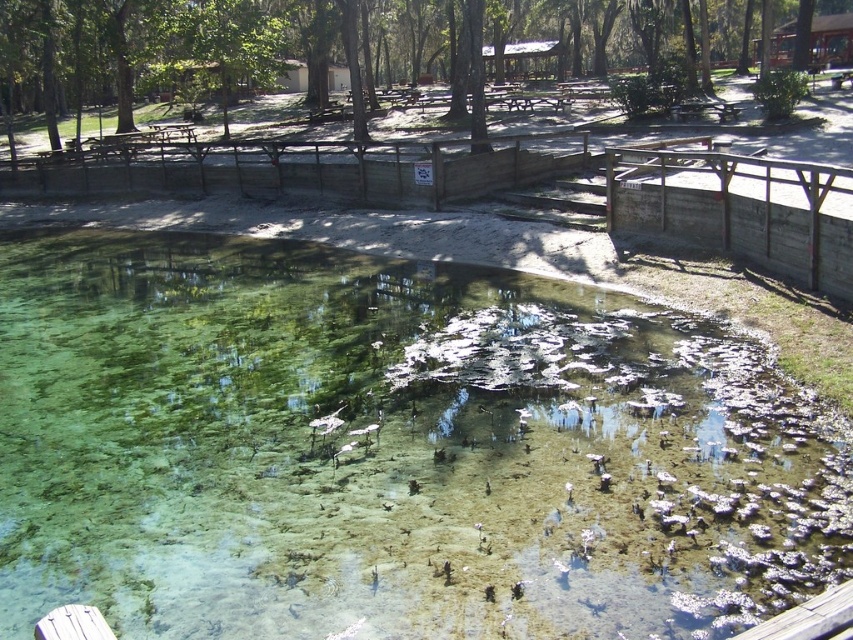
Question: Can you confirm if clear water at center is bigger than green leafy tree at upper center?

Choices:
 (A) no
 (B) yes

Answer: (A)

Question: Is the position of clear water at center more distant than that of green leafy tree at upper center?

Choices:
 (A) no
 (B) yes

Answer: (A)

Question: Which point is closer to the camera?

Choices:
 (A) green leafy tree at upper center
 (B) clear water at center

Answer: (B)

Question: Which point is farther from the camera taking this photo?

Choices:
 (A) (79, 125)
 (B) (726, 536)

Answer: (A)

Question: Is clear water at center to the right of green leafy tree at upper center from the viewer's perspective?

Choices:
 (A) yes
 (B) no

Answer: (B)